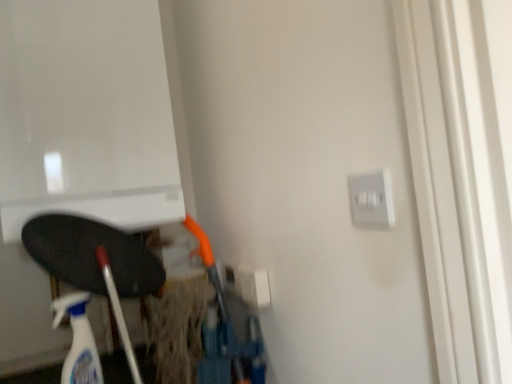
Question: From the image's perspective, is translucent plastic spray bottle at lower left under white plastic electric outlet at center-right, which ranks as the first electric outlet in bottom-to-top order?

Choices:
 (A) no
 (B) yes

Answer: (B)

Question: Is translucent plastic spray bottle at lower left completely or partially outside of white plastic electric outlet at center-right, arranged as the first electric outlet when viewed from the left?

Choices:
 (A) no
 (B) yes

Answer: (B)

Question: Does translucent plastic spray bottle at lower left have a lesser height compared to white plastic electric outlet at center-right, arranged as the first electric outlet when viewed from the left?

Choices:
 (A) yes
 (B) no

Answer: (B)

Question: Is translucent plastic spray bottle at lower left positioned behind white plastic electric outlet at center-right, arranged as the 2th electric outlet when viewed from the top?

Choices:
 (A) no
 (B) yes

Answer: (A)

Question: Does translucent plastic spray bottle at lower left lie in front of white plastic electric outlet at center-right, which ranks as the 2th electric outlet in front-to-back order?

Choices:
 (A) yes
 (B) no

Answer: (A)

Question: Considering the positions of point (259, 284) and point (385, 183), is point (259, 284) closer or farther from the camera than point (385, 183)?

Choices:
 (A) closer
 (B) farther

Answer: (B)

Question: From the image's perspective, is white plastic electric outlet at center-right, arranged as the 2th electric outlet when viewed from the top, positioned above or below satin silver switch at upper right, the first electric outlet when ordered from front to back?

Choices:
 (A) below
 (B) above

Answer: (A)

Question: From a real-world perspective, relative to satin silver switch at upper right, the first electric outlet when ordered from front to back, is white plastic electric outlet at center-right, arranged as the first electric outlet when viewed from the left, vertically above or below?

Choices:
 (A) below
 (B) above

Answer: (A)

Question: Considering their positions, is white plastic electric outlet at center-right, arranged as the second electric outlet when viewed from the right, located in front of or behind satin silver switch at upper right, placed as the second electric outlet when sorted from back to front?

Choices:
 (A) front
 (B) behind

Answer: (B)

Question: Considering the positions of translucent plastic spray bottle at lower left and white plastic electric outlet at center-right, positioned as the 1th electric outlet in back-to-front order, in the image, is translucent plastic spray bottle at lower left wider or thinner than white plastic electric outlet at center-right, positioned as the 1th electric outlet in back-to-front order,?

Choices:
 (A) wide
 (B) thin

Answer: (A)

Question: In terms of height, does translucent plastic spray bottle at lower left look taller or shorter compared to white plastic electric outlet at center-right, arranged as the second electric outlet when viewed from the right?

Choices:
 (A) short
 (B) tall

Answer: (B)

Question: From the image's perspective, is translucent plastic spray bottle at lower left located above or below white plastic electric outlet at center-right, positioned as the 1th electric outlet in back-to-front order?

Choices:
 (A) below
 (B) above

Answer: (A)

Question: Considering the relative positions of translucent plastic spray bottle at lower left and white plastic electric outlet at center-right, arranged as the second electric outlet when viewed from the right, in the image provided, is translucent plastic spray bottle at lower left to the left or to the right of white plastic electric outlet at center-right, arranged as the second electric outlet when viewed from the right,?

Choices:
 (A) left
 (B) right

Answer: (A)

Question: Considering their positions, is satin silver switch at upper right, the first electric outlet when ordered from front to back, located in front of or behind white plastic electric outlet at center-right, positioned as the 1th electric outlet in back-to-front order?

Choices:
 (A) front
 (B) behind

Answer: (A)

Question: From a real-world perspective, is satin silver switch at upper right, the second electric outlet from the left, above or below white plastic electric outlet at center-right, which ranks as the 2th electric outlet in front-to-back order?

Choices:
 (A) above
 (B) below

Answer: (A)